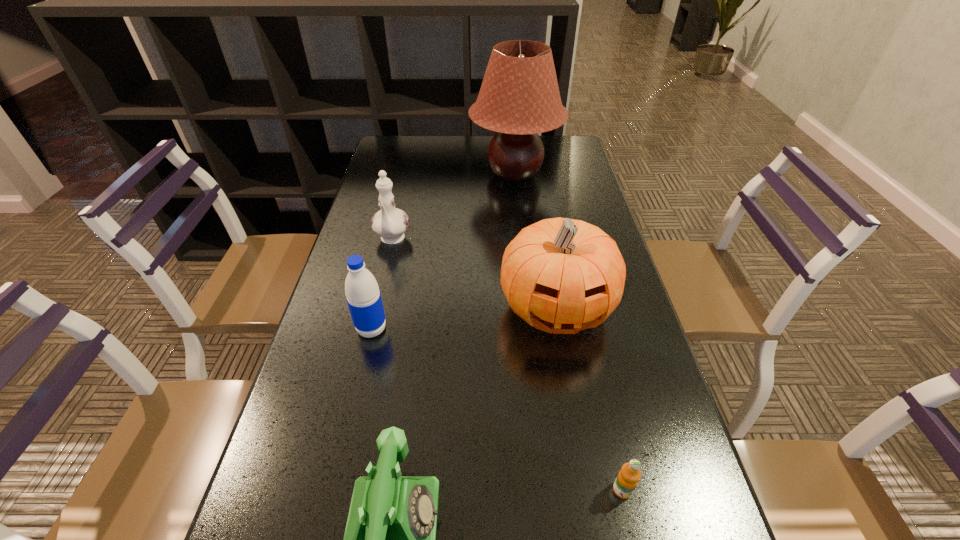
What are the coordinates of `free location located 0.070m at the spout of the second farthest object` in the screenshot? It's located at (384, 273).

The width and height of the screenshot is (960, 540). In order to click on vacant point located on the back of the water bottle in this screenshot , I will do `click(392, 245)`.

What are the coordinates of `vacant position located on the label of the shortest object` in the screenshot? It's located at (634, 539).

The height and width of the screenshot is (540, 960). What are the coordinates of `object situated at the far edge` in the screenshot? It's located at (519, 97).

The width and height of the screenshot is (960, 540). Identify the location of chinaware that is at the left edge. (390, 223).

Locate an element on the screen. This screenshot has width=960, height=540. water bottle that is at the left edge is located at coordinates (362, 292).

The image size is (960, 540). I want to click on lampshade at the right edge, so click(519, 97).

Locate an element on the screen. pumpkin that is at the right edge is located at coordinates (560, 275).

The width and height of the screenshot is (960, 540). Find the location of `orange juice that is at the right edge`. orange juice that is at the right edge is located at coordinates (627, 479).

This screenshot has height=540, width=960. What are the coordinates of `object that is at the far right corner` in the screenshot? It's located at (519, 97).